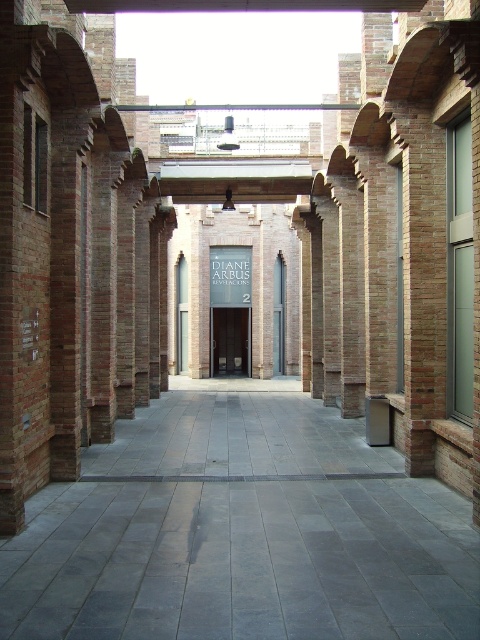
Question: Can you confirm if gray concrete path at center is smaller than black wooden door at center?

Choices:
 (A) no
 (B) yes

Answer: (B)

Question: Is gray concrete path at center above black wooden door at center?

Choices:
 (A) no
 (B) yes

Answer: (A)

Question: Which object appears closest to the camera in this image?

Choices:
 (A) black wooden door at center
 (B) gray concrete path at center

Answer: (B)

Question: Can you confirm if gray concrete path at center is positioned above black wooden door at center?

Choices:
 (A) yes
 (B) no

Answer: (B)

Question: Which point is closer to the camera?

Choices:
 (A) gray concrete path at center
 (B) black wooden door at center

Answer: (A)